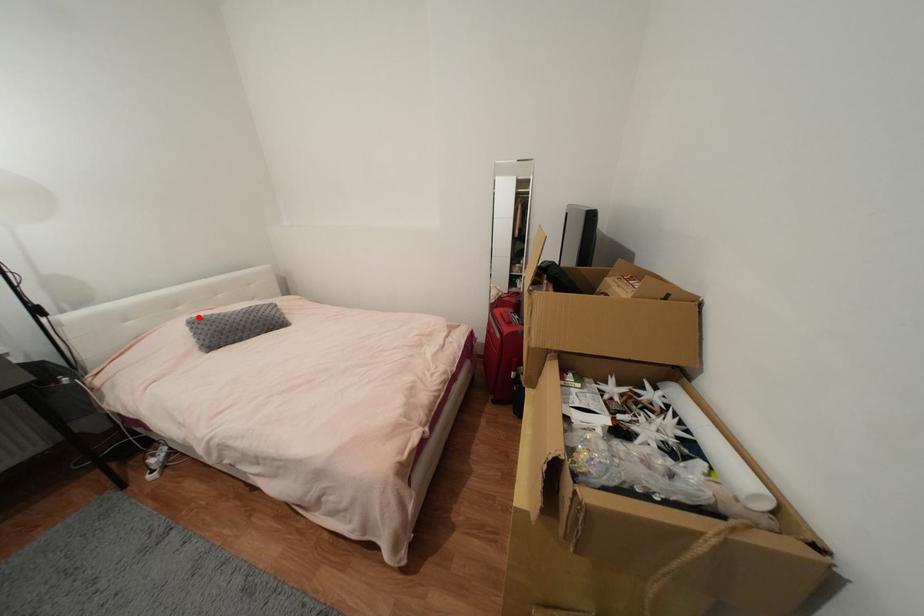
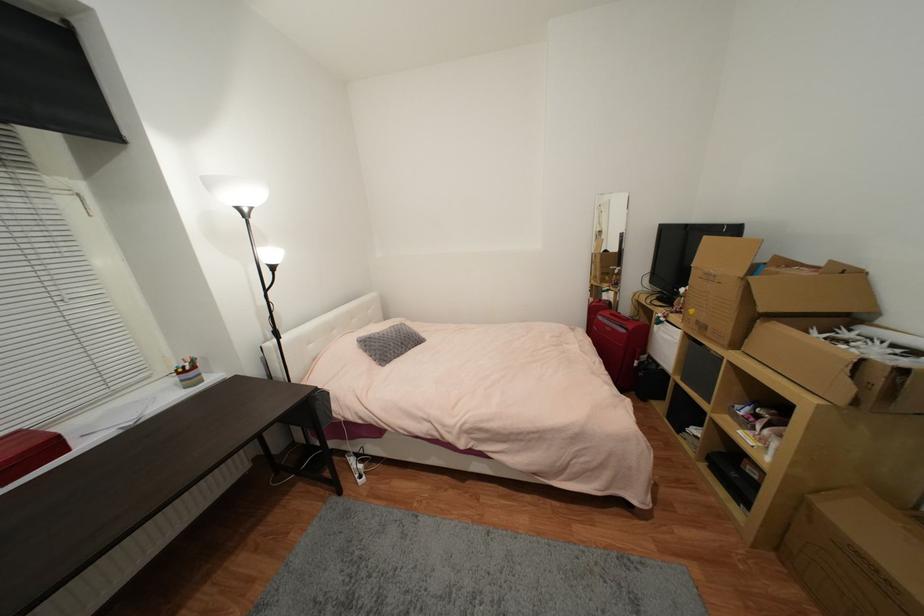
In the second image, find the point that corresponds to the highlighted location in the first image.

(365, 338)